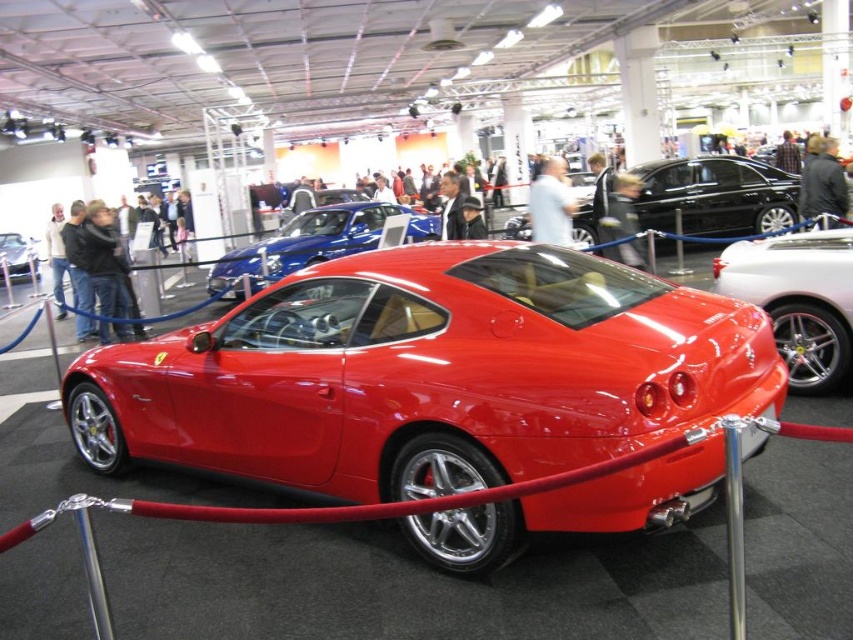
You are an event organizer at the auto show and need to arrange the glossy black sedan at center and the matte black car at center in a row. Which car should be placed first if you want the larger vehicle to be positioned closer to the entrance?

The glossy black sedan at center should be placed first near the entrance because it is larger than the matte black car at center.

You are at an auto show and want to take a photo of the shiny red sports car at center. The auto show has a rule that you must stand exactly at the point marked by coordinates point (428, 372) to take the photo. Can you confirm if this point is the correct location for capturing the car?

Yes, the shiny red sports car at center is represented by point (428, 372), so standing at this point will allow you to capture the car accurately.

You are a photographer at the auto show and need to capture both the shiny red sports car at center and the glossy metallic car at center in a single wide shot. Given that your camera has a maximum focal length of 24mm, which allows capturing a horizontal field of view of 75 degrees, can you position yourself far enough away to include both cars in the frame?

The shiny red sports car at center and glossy metallic car at center are 17.14 meters apart. To capture both in a single shot with a 24mm lens, the photographer needs to position themselves at a distance where the 75 degree field of view can encompass the 17.14 meter separation. Using trigonometry, the minimum distance required would be approximately 12.3 meters. Since the cars are part of an exhibition display, the photographer should check if there is sufficient space to step back that far without encroa